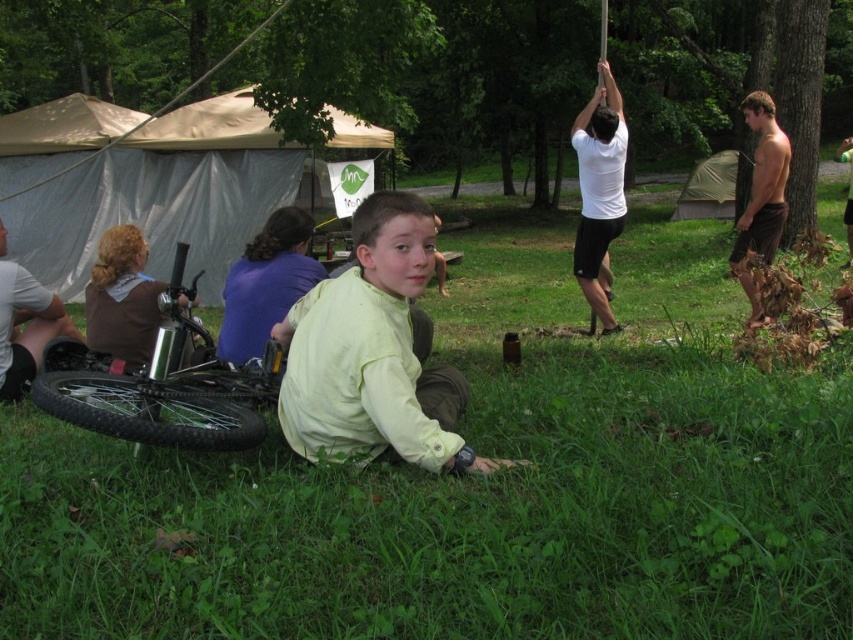
Who is higher up, black rubber tire at lower left or green canvas tent at center?

Positioned higher is green canvas tent at center.

Can you confirm if black rubber tire at lower left is wider than green canvas tent at center?

Incorrect, black rubber tire at lower left's width does not surpass green canvas tent at center's.

Locate an element on the screen. black rubber tire at lower left is located at coordinates tap(148, 410).

Consider the image. Who is shorter, white matte shirt at upper right or brushed metal water bottle at left?

brushed metal water bottle at left

Does white matte shirt at upper right have a lesser height compared to brushed metal water bottle at left?

In fact, white matte shirt at upper right may be taller than brushed metal water bottle at left.

The height and width of the screenshot is (640, 853). What do you see at coordinates (599, 192) in the screenshot? I see `white matte shirt at upper right` at bounding box center [599, 192].

I want to click on white matte shirt at upper right, so click(x=599, y=192).

Is green grass at lower center smaller than brushed metal water bottle at left?

No.

How distant is green grass at lower center from brushed metal water bottle at left?

2.18 meters

Who is more distant from viewer, (602, 392) or (26, 326)?

Point (26, 326)

Locate an element on the screen. green grass at lower center is located at coordinates (479, 483).